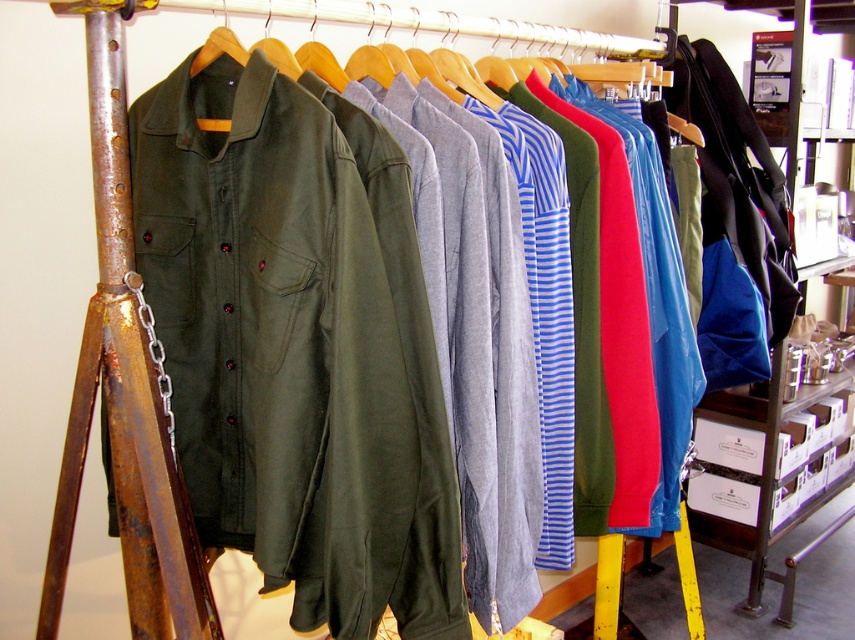
Question: Is olive green cotton jacket at left below rusty metal ladder at left?

Choices:
 (A) yes
 (B) no

Answer: (A)

Question: Which point is farther to the camera?

Choices:
 (A) (171, 492)
 (B) (439, 465)

Answer: (B)

Question: Which object is closer to the camera taking this photo?

Choices:
 (A) rusty metal ladder at left
 (B) olive green cotton jacket at left

Answer: (A)

Question: Which point appears farthest from the camera in this image?

Choices:
 (A) (319, 164)
 (B) (181, 604)

Answer: (B)

Question: Observing the image, what is the correct spatial positioning of olive green cotton jacket at left in reference to rusty metal ladder at left?

Choices:
 (A) right
 (B) left

Answer: (A)

Question: Is olive green cotton jacket at left below rusty metal ladder at left?

Choices:
 (A) no
 (B) yes

Answer: (B)